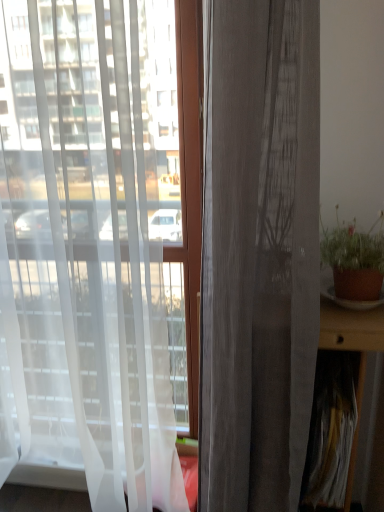
The image size is (384, 512). What are the coordinates of `brown wooden table at right` in the screenshot? It's located at (352, 333).

What do you see at coordinates (354, 259) in the screenshot?
I see `brown clay pot at right` at bounding box center [354, 259].

Where is `white sheer curtain at left, arranged as the 1th curtain when viewed from the left`? Image resolution: width=384 pixels, height=512 pixels. white sheer curtain at left, arranged as the 1th curtain when viewed from the left is located at coordinates (84, 257).

Who is taller, matte gray curtain at center, the 1th curtain in the right-to-left sequence, or white sheer curtain at left, positioned as the second curtain in right-to-left order?

white sheer curtain at left, positioned as the second curtain in right-to-left order, is taller.

From a real-world perspective, is matte gray curtain at center, which is the 2th curtain in left-to-right order, located beneath white sheer curtain at left, positioned as the second curtain in right-to-left order?

Result: Yes, from a real-world perspective, matte gray curtain at center, which is the 2th curtain in left-to-right order, is under white sheer curtain at left, positioned as the second curtain in right-to-left order.

How different are the orientations of matte gray curtain at center, which is the 2th curtain in left-to-right order, and white sheer curtain at left, positioned as the second curtain in right-to-left order, in degrees?

The angular difference between matte gray curtain at center, which is the 2th curtain in left-to-right order, and white sheer curtain at left, positioned as the second curtain in right-to-left order, is 0.000442 degrees.

Between matte gray curtain at center, the 1th curtain in the right-to-left sequence, and white sheer curtain at left, arranged as the 1th curtain when viewed from the left, which one appears on the left side from the viewer's perspective?

Positioned to the left is white sheer curtain at left, arranged as the 1th curtain when viewed from the left.

From the image's perspective, count 1st curtains upward from the brown wooden table at right and point to it. Please provide its 2D coordinates.

[(259, 252)]

Based on the photo, between brown wooden table at right and matte gray curtain at center, which is the 2th curtain in left-to-right order, which one appears on the left side from the viewer's perspective?

matte gray curtain at center, which is the 2th curtain in left-to-right order.

Is brown wooden table at right not inside matte gray curtain at center, the 1th curtain in the right-to-left sequence?

Yes.

Can you tell me how much brown wooden table at right and matte gray curtain at center, which is the 2th curtain in left-to-right order, differ in facing direction?

0.000452 degrees separate the facing orientations of brown wooden table at right and matte gray curtain at center, which is the 2th curtain in left-to-right order.

Is brown clay pot at right positioned before brown wooden table at right?

No, it is not.

Is brown clay pot at right situated inside brown wooden table at right or outside?

brown clay pot at right is located beyond the bounds of brown wooden table at right.

Considering the sizes of brown clay pot at right and brown wooden table at right in the image, is brown clay pot at right wider or thinner than brown wooden table at right?

In the image, brown clay pot at right appears to be more narrow than brown wooden table at right.

Considering the relative sizes of brown clay pot at right and brown wooden table at right in the image provided, is brown clay pot at right taller than brown wooden table at right?

Incorrect, the height of brown clay pot at right is not larger of that of brown wooden table at right.

Can brown clay pot at right be found inside brown wooden table at right?

No, brown clay pot at right is not surrounded by brown wooden table at right.

Considering the positions of point (352, 472) and point (340, 282), is point (352, 472) closer or farther from the camera than point (340, 282)?

Point (352, 472) appears to be farther away from the viewer than point (340, 282).

From the image's perspective, who appears lower, brown wooden table at right or brown clay pot at right?

brown wooden table at right is shown below in the image.

Would you say brown wooden table at right is to the left or to the right of brown clay pot at right in the picture?

Based on their positions, brown wooden table at right is located to the left of brown clay pot at right.

From a real-world perspective, is white sheer curtain at left, arranged as the 1th curtain when viewed from the left, positioned above or below matte gray curtain at center, the 1th curtain in the right-to-left sequence?

From a real-world perspective, white sheer curtain at left, arranged as the 1th curtain when viewed from the left, is physically above matte gray curtain at center, the 1th curtain in the right-to-left sequence.

Is matte gray curtain at center, which is the 2th curtain in left-to-right order, surrounded by white sheer curtain at left, arranged as the 1th curtain when viewed from the left?

No, matte gray curtain at center, which is the 2th curtain in left-to-right order, is not inside white sheer curtain at left, arranged as the 1th curtain when viewed from the left.

From the image's perspective, who appears lower, white sheer curtain at left, arranged as the 1th curtain when viewed from the left, or matte gray curtain at center, the 1th curtain in the right-to-left sequence?

matte gray curtain at center, the 1th curtain in the right-to-left sequence, from the image's perspective.

Where is `curtain that is below the white sheer curtain at left, arranged as the 1th curtain when viewed from the left (from the image's perspective)`? The height and width of the screenshot is (512, 384). curtain that is below the white sheer curtain at left, arranged as the 1th curtain when viewed from the left (from the image's perspective) is located at coordinates (259, 252).

Is white sheer curtain at left, positioned as the second curtain in right-to-left order, oriented away from brown wooden table at right?

No, white sheer curtain at left, positioned as the second curtain in right-to-left order, is not facing the opposite direction of brown wooden table at right.

Looking at this image, who is bigger, white sheer curtain at left, arranged as the 1th curtain when viewed from the left, or brown wooden table at right?

Bigger between the two is white sheer curtain at left, arranged as the 1th curtain when viewed from the left.

Choose the correct answer: Is white sheer curtain at left, arranged as the 1th curtain when viewed from the left, inside brown wooden table at right or outside it?

white sheer curtain at left, arranged as the 1th curtain when viewed from the left, is not inside brown wooden table at right, it's outside.

Is brown clay pot at right facing towards matte gray curtain at center, which is the 2th curtain in left-to-right order?

No, brown clay pot at right is not oriented towards matte gray curtain at center, which is the 2th curtain in left-to-right order.

Is brown clay pot at right taller than matte gray curtain at center, which is the 2th curtain in left-to-right order?

No.

From a real-world perspective, relative to matte gray curtain at center, which is the 2th curtain in left-to-right order, is brown clay pot at right vertically above or below?

Clearly, from a real-world perspective, brown clay pot at right is above matte gray curtain at center, which is the 2th curtain in left-to-right order.

The width and height of the screenshot is (384, 512). What are the coordinates of `the 2nd curtain in front when counting from the brown clay pot at right` in the screenshot? It's located at (259, 252).

At what (x,y) coordinates should I click in order to perform the action: click on curtain lying above the matte gray curtain at center, the 1th curtain in the right-to-left sequence (from the image's perspective). Please return your answer as a coordinate pair (x, y). Image resolution: width=384 pixels, height=512 pixels. Looking at the image, I should click on (84, 257).

Find the location of `the 2nd curtain in front of the brown wooden table at right, starting your count from the anchor`. the 2nd curtain in front of the brown wooden table at right, starting your count from the anchor is located at coordinates [x=259, y=252].

Which object lies nearer to the anchor point brown clay pot at right, matte gray curtain at center, which is the 2th curtain in left-to-right order, or brown wooden table at right?

brown wooden table at right lies closer to brown clay pot at right than the other object.

From the image, which object appears to be farther from white sheer curtain at left, positioned as the second curtain in right-to-left order, brown wooden table at right or matte gray curtain at center, the 1th curtain in the right-to-left sequence?

brown wooden table at right is positioned further to the anchor white sheer curtain at left, positioned as the second curtain in right-to-left order.

Based on the photo, considering their positions, is brown clay pot at right positioned closer to brown wooden table at right than matte gray curtain at center, the 1th curtain in the right-to-left sequence?

Based on the image, brown clay pot at right appears to be nearer to brown wooden table at right.

Based on their spatial positions, is brown wooden table at right or brown clay pot at right closer to white sheer curtain at left, positioned as the second curtain in right-to-left order?

brown clay pot at right lies closer to white sheer curtain at left, positioned as the second curtain in right-to-left order, than the other object.

Considering their positions, is brown clay pot at right positioned closer to matte gray curtain at center, which is the 2th curtain in left-to-right order, than brown wooden table at right?

Based on the image, brown wooden table at right appears to be nearer to matte gray curtain at center, which is the 2th curtain in left-to-right order.

Based on their spatial positions, is white sheer curtain at left, positioned as the second curtain in right-to-left order, or brown wooden table at right further from matte gray curtain at center, the 1th curtain in the right-to-left sequence?

white sheer curtain at left, positioned as the second curtain in right-to-left order, lies further to matte gray curtain at center, the 1th curtain in the right-to-left sequence, than the other object.

Estimate the real-world distances between objects in this image. Which object is further from brown wooden table at right, white sheer curtain at left, positioned as the second curtain in right-to-left order, or matte gray curtain at center, the 1th curtain in the right-to-left sequence?

white sheer curtain at left, positioned as the second curtain in right-to-left order.

Consider the image. Estimate the real-world distances between objects in this image. Which object is further from matte gray curtain at center, the 1th curtain in the right-to-left sequence, white sheer curtain at left, positioned as the second curtain in right-to-left order, or brown clay pot at right?

Among the two, white sheer curtain at left, positioned as the second curtain in right-to-left order, is located further to matte gray curtain at center, the 1th curtain in the right-to-left sequence.

The width and height of the screenshot is (384, 512). What are the coordinates of `curtain between white sheer curtain at left, arranged as the 1th curtain when viewed from the left, and brown clay pot at right, in the horizontal direction` in the screenshot? It's located at (259, 252).

Find the location of a particular element. curtain located between white sheer curtain at left, positioned as the second curtain in right-to-left order, and brown wooden table at right in the left-right direction is located at coordinates (259, 252).

I want to click on table located between white sheer curtain at left, positioned as the second curtain in right-to-left order, and brown clay pot at right in the left-right direction, so click(352, 333).